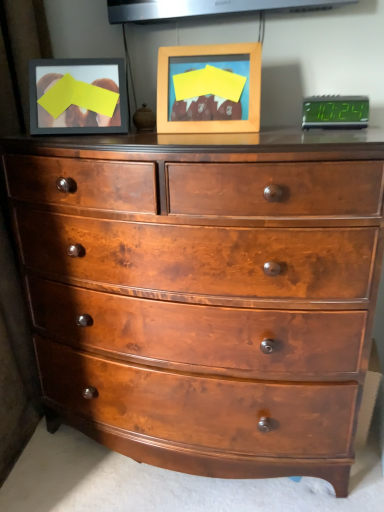
Question: Is point (314, 101) positioned closer to the camera than point (228, 211)?

Choices:
 (A) farther
 (B) closer

Answer: (A)

Question: Considering the relative positions of green digital display at upper right and shiny brown wood chest of drawers at center in the image provided, is green digital display at upper right to the left or to the right of shiny brown wood chest of drawers at center?

Choices:
 (A) right
 (B) left

Answer: (A)

Question: Which is nearer to the wooden picture frame at center?

Choices:
 (A) green digital display at upper right
 (B) shiny brown wood chest of drawers at center

Answer: (A)

Question: Which object is positioned closest to the wooden picture frame at center?

Choices:
 (A) green digital display at upper right
 (B) shiny brown wood chest of drawers at center

Answer: (A)